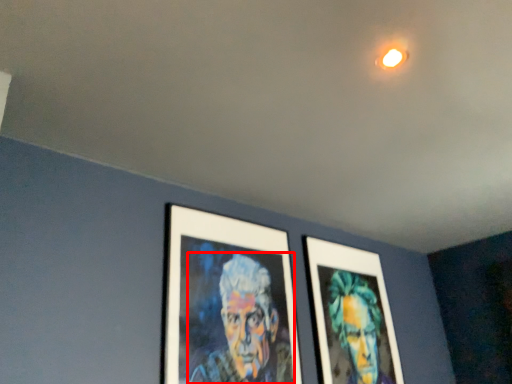
Question: From the image's perspective, what is the correct spatial relationship of person (annotated by the red box) in relation to person?

Choices:
 (A) below
 (B) above

Answer: (B)